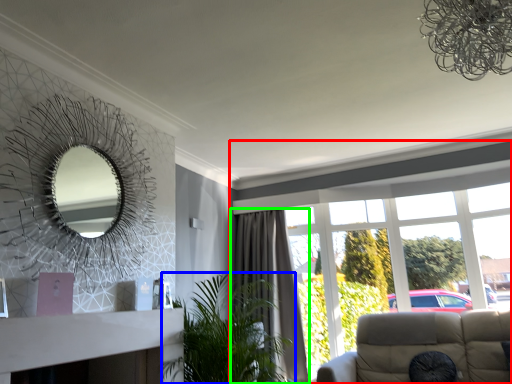
Question: Which is farther away from window (highlighted by a red box)? houseplant (highlighted by a blue box) or curtain (highlighted by a green box)?

Choices:
 (A) houseplant
 (B) curtain

Answer: (A)